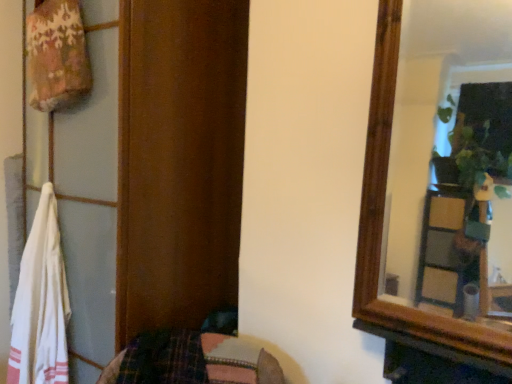
Question: Considering the positions of white cotton towel at left and wooden dresser at left in the image, is white cotton towel at left taller or shorter than wooden dresser at left?

Choices:
 (A) tall
 (B) short

Answer: (B)

Question: From a real-world perspective, is white cotton towel at left physically located above or below wooden dresser at left?

Choices:
 (A) below
 (B) above

Answer: (A)

Question: From the image's perspective, is white cotton towel at left above or below wooden dresser at left?

Choices:
 (A) above
 (B) below

Answer: (B)

Question: Would you say wooden dresser at left is to the left or to the right of white cotton towel at left in the picture?

Choices:
 (A) right
 (B) left

Answer: (A)

Question: Is wooden dresser at left taller or shorter than white cotton towel at left?

Choices:
 (A) short
 (B) tall

Answer: (B)

Question: Considering the positions of wooden dresser at left and white cotton towel at left in the image, is wooden dresser at left wider or thinner than white cotton towel at left?

Choices:
 (A) wide
 (B) thin

Answer: (A)

Question: Based on their sizes in the image, would you say wooden dresser at left is bigger or smaller than white cotton towel at left?

Choices:
 (A) small
 (B) big

Answer: (B)